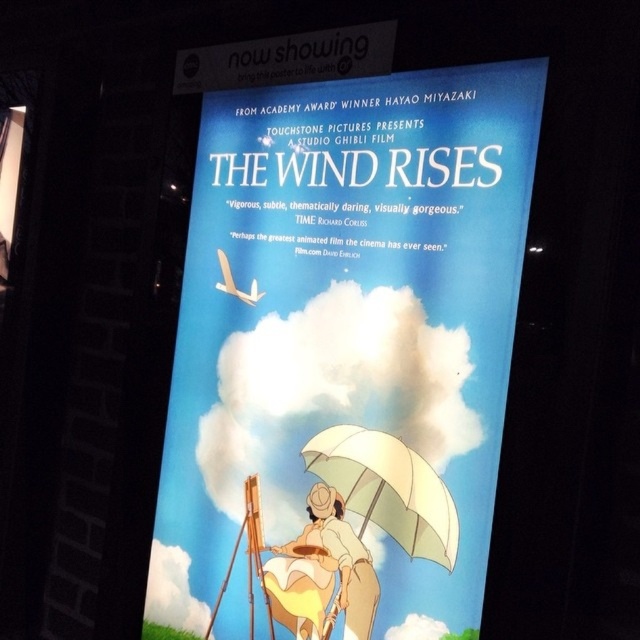
Looking at the promotional materials for the film, you see the matte paper poster at center and the white matte umbrella at center. Which object is positioned to the left?

The matte paper poster at center is positioned to the left of the white matte umbrella at center.

You are an art student who wants to frame the matte paper poster at center and the matte yellow dress at center for an exhibition. Which object requires a wider frame due to its size?

The matte paper poster at center requires a wider frame because its width surpasses that of the matte yellow dress at center.